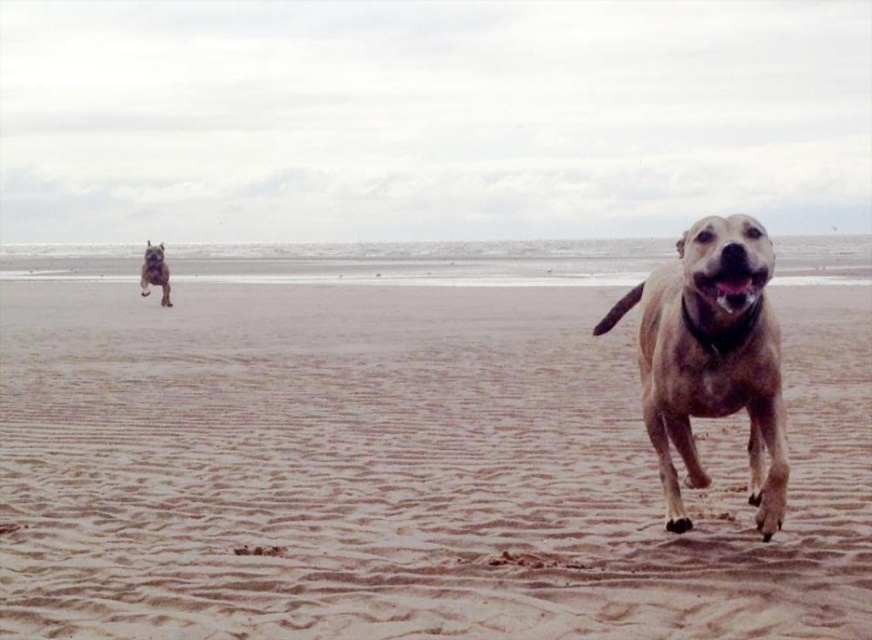
You are a photographer trying to capture the entire brown sandy beach at center and the shiny brown fur at upper left in one shot. Based on their sizes, which object should you focus on to ensure both fit in the frame?

The brown sandy beach at center has a larger width than the shiny brown fur at upper left, so focusing on the brown sandy beach at center would help ensure both fit in the frame since it occupies more space.